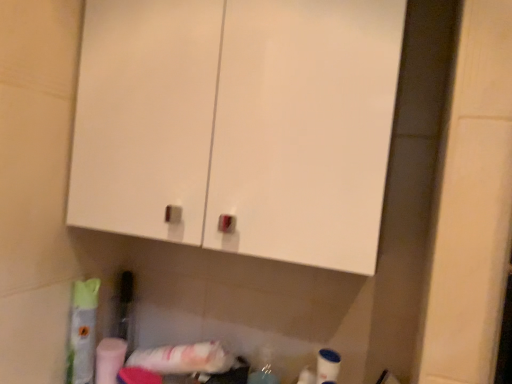
Question: Does white glossy cabinet at upper center have a lesser height compared to white matte toilet paper at lower left?

Choices:
 (A) no
 (B) yes

Answer: (A)

Question: From the image's perspective, is white glossy cabinet at upper center below white matte toilet paper at lower left?

Choices:
 (A) no
 (B) yes

Answer: (A)

Question: Does white glossy cabinet at upper center have a lesser width compared to white matte toilet paper at lower left?

Choices:
 (A) yes
 (B) no

Answer: (B)

Question: Considering the relative sizes of white glossy cabinet at upper center and white matte toilet paper at lower left in the image provided, is white glossy cabinet at upper center wider than white matte toilet paper at lower left?

Choices:
 (A) no
 (B) yes

Answer: (B)

Question: Is white glossy cabinet at upper center at the right side of white matte toilet paper at lower left?

Choices:
 (A) no
 (B) yes

Answer: (B)

Question: From a real-world perspective, is white glossy cabinet at upper center over white matte toilet paper at lower left?

Choices:
 (A) no
 (B) yes

Answer: (B)

Question: From the image's perspective, does white matte toilet paper at lower left appear lower than white glossy cabinet at upper center?

Choices:
 (A) yes
 (B) no

Answer: (A)

Question: Does white matte toilet paper at lower left have a smaller size compared to white glossy cabinet at upper center?

Choices:
 (A) yes
 (B) no

Answer: (A)

Question: Is white matte toilet paper at lower left next to white glossy cabinet at upper center?

Choices:
 (A) yes
 (B) no

Answer: (B)

Question: Is white matte toilet paper at lower left bigger than white glossy cabinet at upper center?

Choices:
 (A) no
 (B) yes

Answer: (A)

Question: From the image's perspective, is white matte toilet paper at lower left over white glossy cabinet at upper center?

Choices:
 (A) no
 (B) yes

Answer: (A)

Question: Is white matte toilet paper at lower left taller than white glossy cabinet at upper center?

Choices:
 (A) no
 (B) yes

Answer: (A)

Question: Considering the positions of white glossy cabinet at upper center and white matte toilet paper at lower left in the image, is white glossy cabinet at upper center wider or thinner than white matte toilet paper at lower left?

Choices:
 (A) wide
 (B) thin

Answer: (A)